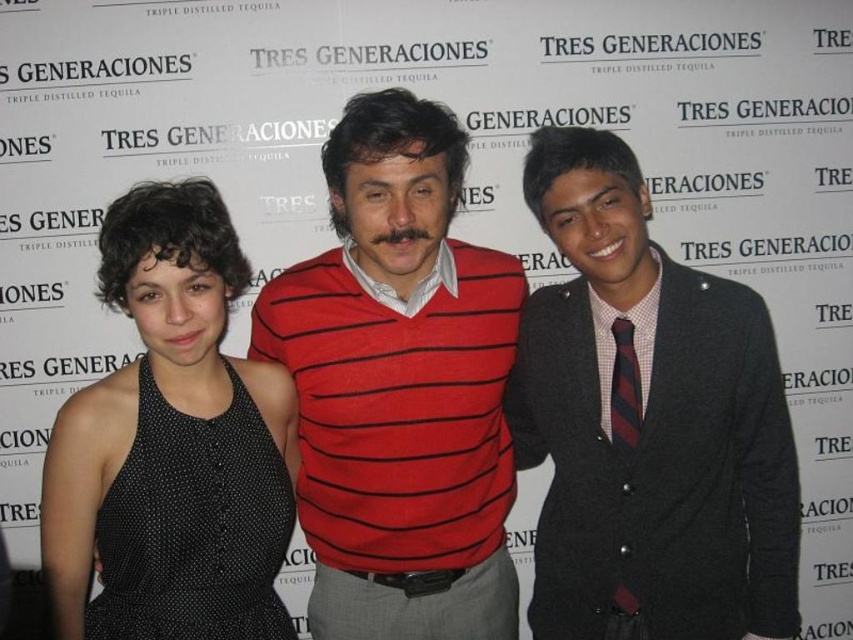
Question: Which of the following is the farthest from the observer?

Choices:
 (A) [422, 390]
 (B) [680, 568]

Answer: (A)

Question: Which object appears closest to the camera in this image?

Choices:
 (A) red striped sweater at center
 (B) black dotted dress at left

Answer: (B)

Question: Which of the following is the farthest from the observer?

Choices:
 (A) (408, 378)
 (B) (589, 522)
 (C) (107, 438)

Answer: (B)

Question: Does red striped sweater at center appear on the right side of black dotted dress at left?

Choices:
 (A) no
 (B) yes

Answer: (B)

Question: Does red striped sweater at center have a smaller size compared to black dotted dress at left?

Choices:
 (A) yes
 (B) no

Answer: (B)

Question: Is dark gray wool cardigan at center closer to camera compared to red striped sweater at center?

Choices:
 (A) yes
 (B) no

Answer: (B)